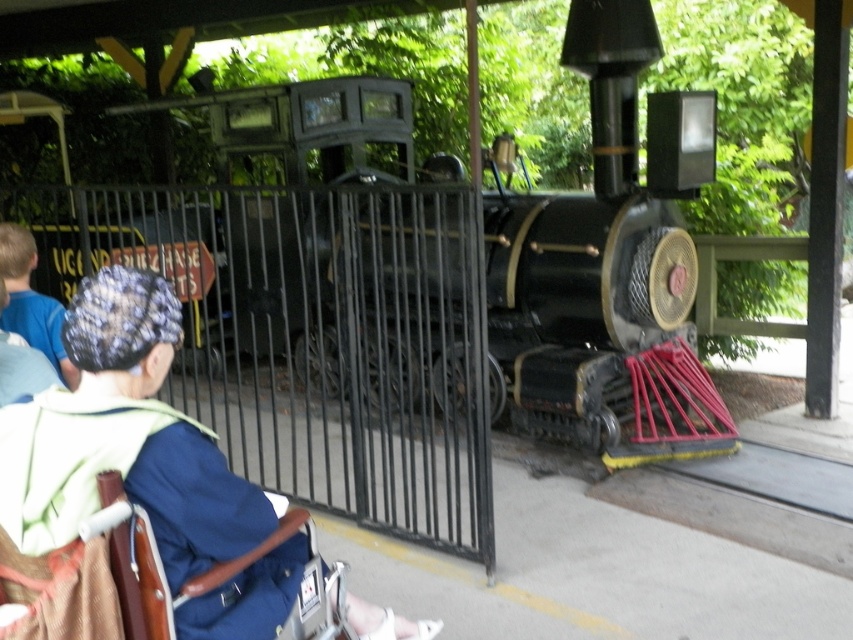
Question: Which object appears closest to the camera in this image?

Choices:
 (A) blue fabric cap at upper left
 (B) blue fabric jacket at lower left
 (C) polished black locomotive at center

Answer: (B)

Question: Does polished black locomotive at center have a smaller size compared to blue fabric jacket at lower left?

Choices:
 (A) yes
 (B) no

Answer: (B)

Question: Which object appears closest to the camera in this image?

Choices:
 (A) blue fabric cap at upper left
 (B) polished black locomotive at center
 (C) blue fabric jacket at lower left

Answer: (C)

Question: Which of these objects is positioned farthest from the blue fabric cap at upper left?

Choices:
 (A) blue fabric jacket at lower left
 (B) polished black locomotive at center

Answer: (B)

Question: Can you confirm if polished black locomotive at center is positioned below blue fabric jacket at lower left?

Choices:
 (A) no
 (B) yes

Answer: (A)

Question: Does blue fabric jacket at lower left lie in front of blue fabric cap at upper left?

Choices:
 (A) no
 (B) yes

Answer: (B)